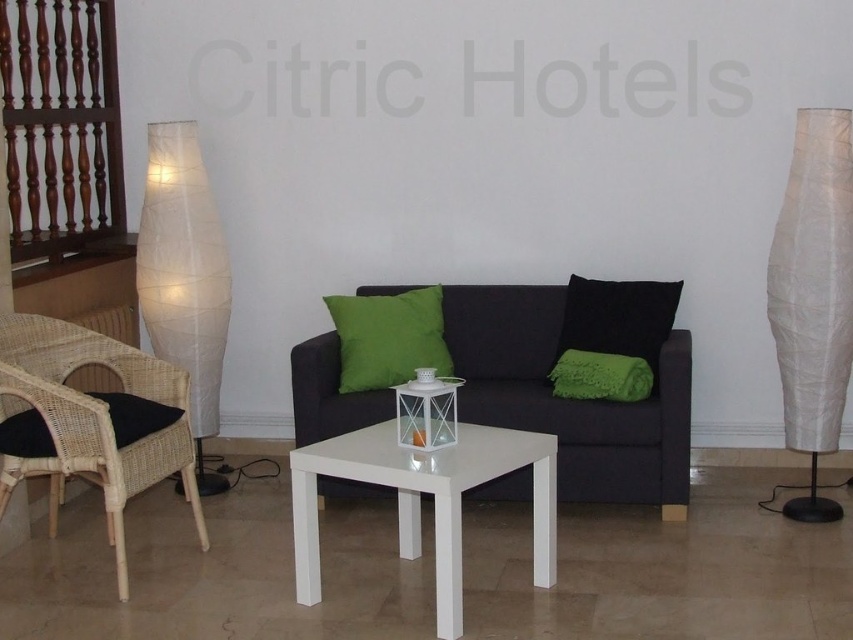
Question: Which of the following is the closest to the observer?

Choices:
 (A) (595, 369)
 (B) (526, 477)
 (C) (376, 339)
 (D) (772, 262)

Answer: (D)

Question: Considering the relative positions of white paper lamp at right and white glossy table at center in the image provided, where is white paper lamp at right located with respect to white glossy table at center?

Choices:
 (A) above
 (B) below

Answer: (A)

Question: Does woven rattan armchair at left appear on the left side of white paper lamp at left?

Choices:
 (A) no
 (B) yes

Answer: (B)

Question: Among these points, which one is farthest from the camera?

Choices:
 (A) (839, 268)
 (B) (573, 396)
 (C) (410, 557)
 (D) (395, 312)

Answer: (D)

Question: Considering the real-world distances, which object is farthest from the black fabric couch at center?

Choices:
 (A) white paper lamp at left
 (B) white paper lamp at right

Answer: (A)

Question: Where is white paper lamp at right located in relation to green textured blanket at right in the image?

Choices:
 (A) left
 (B) right

Answer: (B)